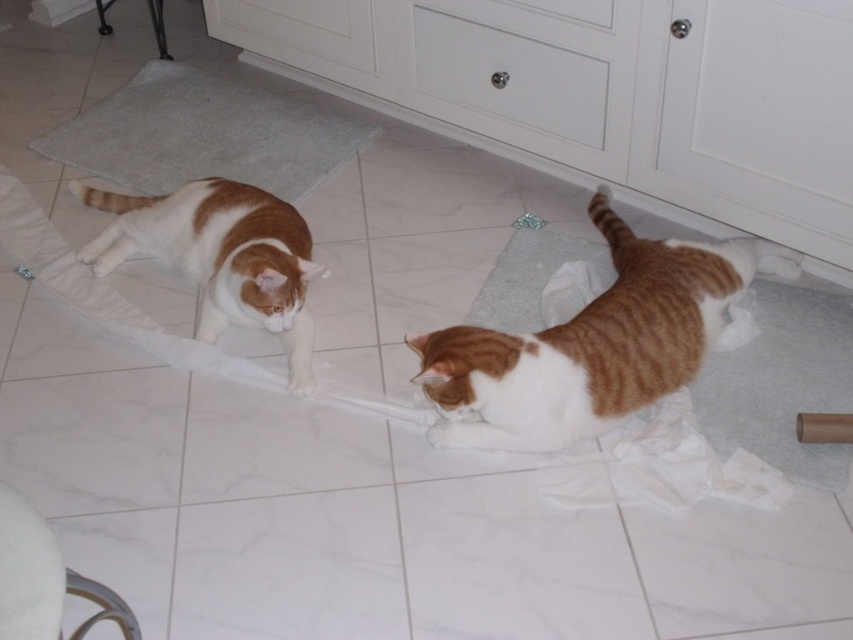
Question: Does orange tabby cat at lower right have a smaller size compared to white matte drawer at upper center?

Choices:
 (A) no
 (B) yes

Answer: (A)

Question: Which object is closer to the camera taking this photo?

Choices:
 (A) white matte drawer at upper center
 (B) white glossy cabinet at upper center
 (C) gray soft mat at upper left
 (D) orange-white fur cat at left

Answer: (B)

Question: Can you confirm if orange tabby cat at lower right is thinner than white matte drawer at upper center?

Choices:
 (A) yes
 (B) no

Answer: (B)

Question: Is white matte drawer at upper center below orange-white fur cat at left?

Choices:
 (A) yes
 (B) no

Answer: (B)

Question: Which object is positioned closest to the orange tabby cat at lower right?

Choices:
 (A) white glossy cabinet at upper center
 (B) white matte drawer at upper center
 (C) orange-white fur cat at left
 (D) gray soft mat at upper left

Answer: (B)

Question: Which point is closer to the camera taking this photo?

Choices:
 (A) (131, 227)
 (B) (757, 262)
 (C) (766, 22)

Answer: (C)